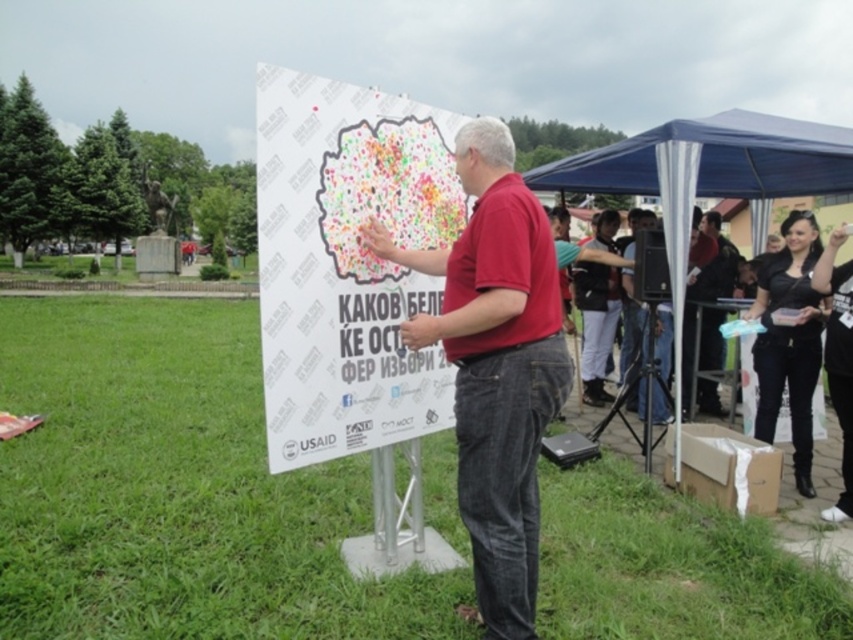
Between matte red shirt at center and black leather shoes at lower right, which one appears on the right side from the viewer's perspective?

black leather shoes at lower right

Between matte red shirt at center and black leather shoes at lower right, which one appears on the left side from the viewer's perspective?

matte red shirt at center is more to the left.

Does point (506, 515) come behind point (848, 342)?

No, it is in front of (848, 342).

Where is `matte red shirt at center`? The width and height of the screenshot is (853, 640). matte red shirt at center is located at coordinates (495, 365).

Is white paper poster at center in front of blue fabric canopy at upper right?

Yes, white paper poster at center is in front of blue fabric canopy at upper right.

Is point (364, 99) positioned after point (846, 150)?

No.

Is point (357, 296) farther from camera compared to point (770, 125)?

No, it is in front of (770, 125).

At what (x,y) coordinates should I click in order to perform the action: click on white paper poster at center. Please return your answer as a coordinate pair (x, y). The height and width of the screenshot is (640, 853). Looking at the image, I should click on (347, 264).

Who is lower down, white paper poster at center or black leather jacket at lower right?

black leather jacket at lower right is below.

Who is more forward, (x=386, y=168) or (x=805, y=266)?

Point (x=386, y=168) is more forward.

Measure the distance between point (x=370, y=364) and camera.

They are 10.17 feet apart.

Find the location of a particular element. The width and height of the screenshot is (853, 640). white paper poster at center is located at coordinates (347, 264).